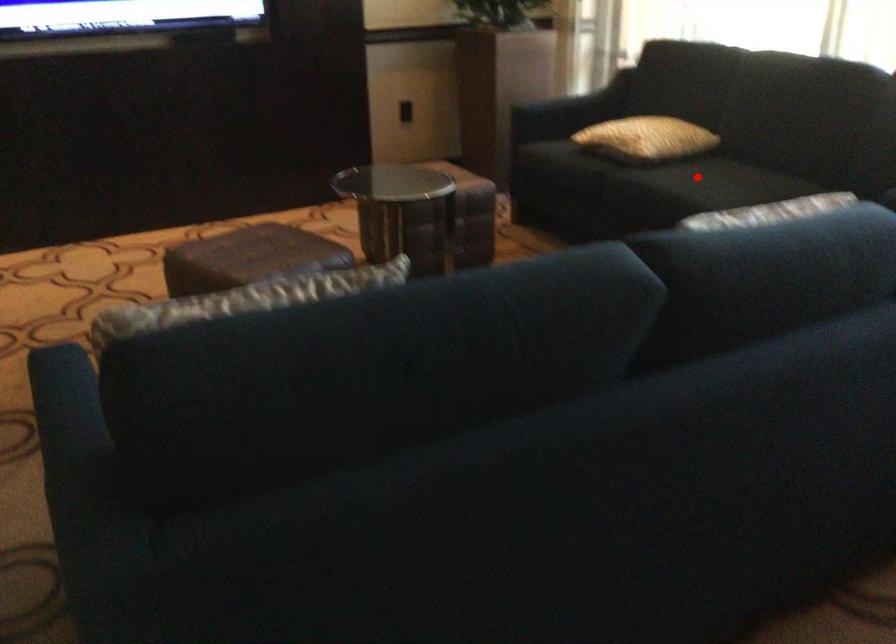
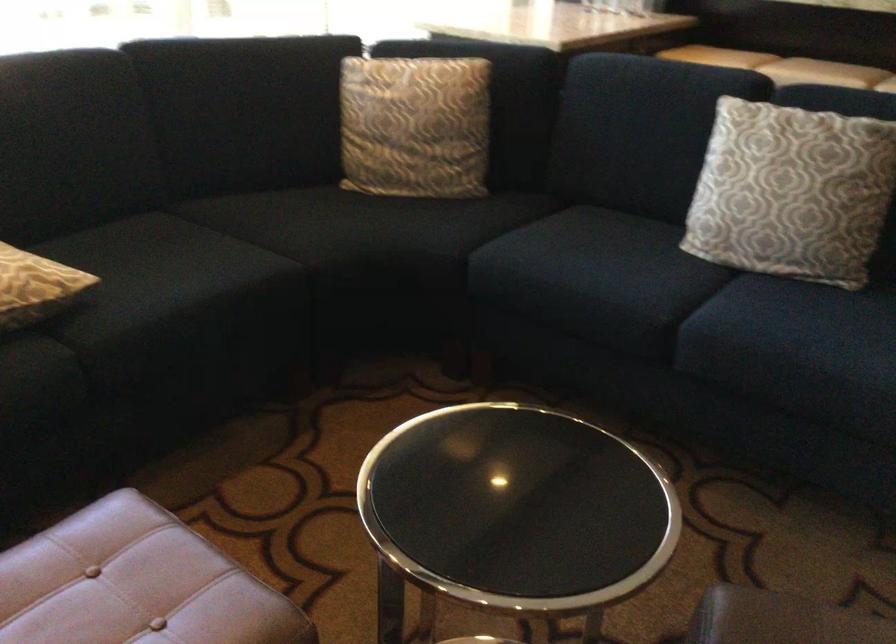
Where in the second image is the point corresponding to the highlighted location from the first image?

(161, 270)